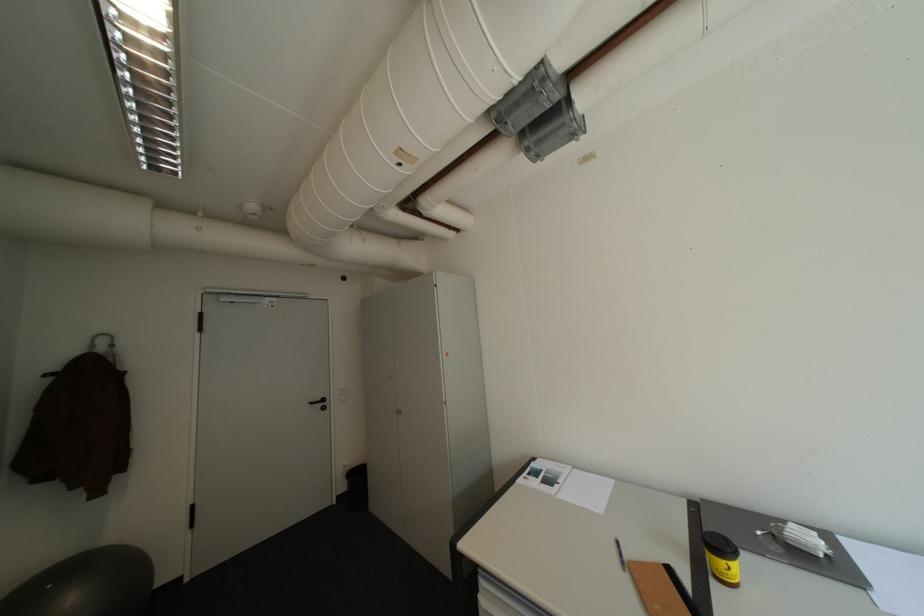
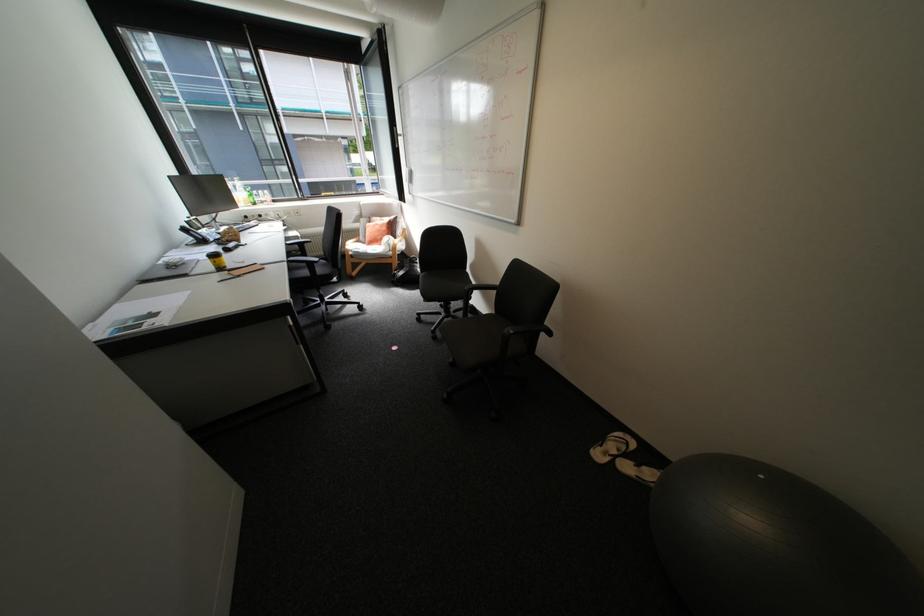
Locate, in the second image, the point that corresponds to point (59, 586) in the first image.

(772, 477)